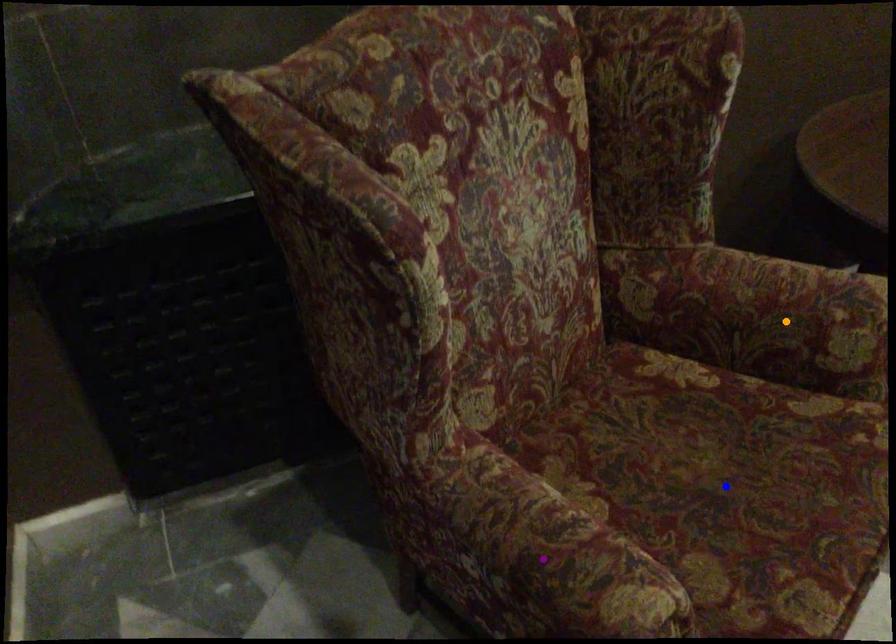
Order these from nearest to farthest:
A) purple point
B) orange point
C) blue point

orange point → purple point → blue point